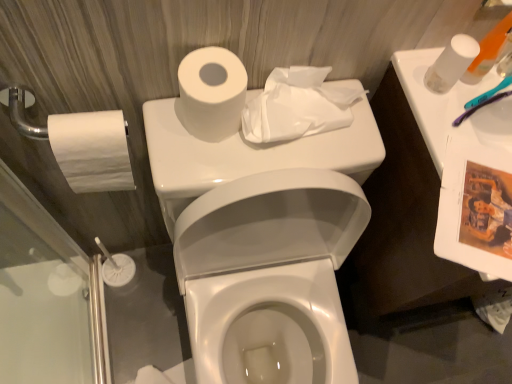
Locate an element on the screen. This screenshot has width=512, height=384. vacant area that lies to the right of white matte toilet paper at upper center, acting as the second toilet paper starting from the left is located at coordinates (298, 156).